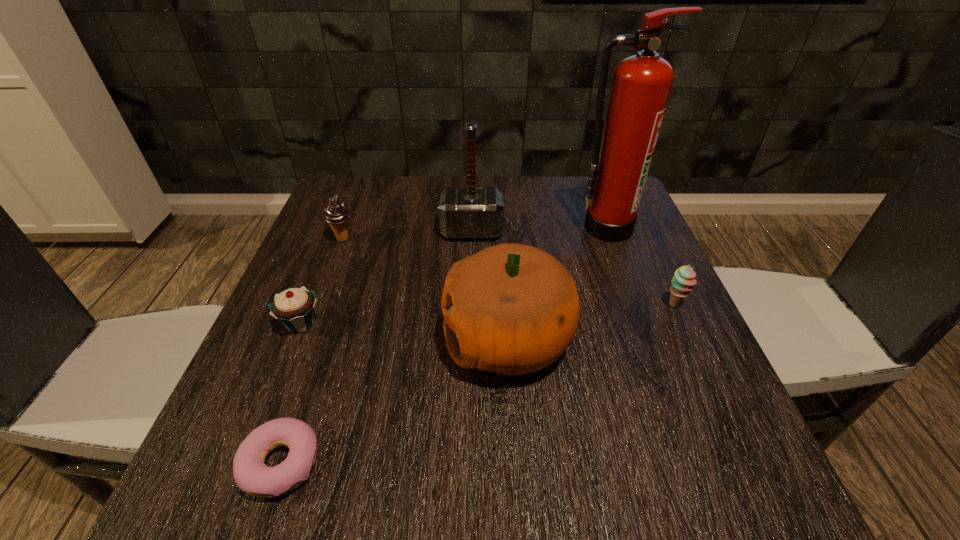
Identify the location of fire extinguisher. The image size is (960, 540). coord(641,85).

Find the location of a particular element. the sixth shortest object is located at coordinates (464, 213).

Image resolution: width=960 pixels, height=540 pixels. Identify the location of the fifth shortest object. (511, 309).

I want to click on icecream, so click(x=336, y=214).

Locate an element on the screen. This screenshot has width=960, height=540. sherbert is located at coordinates (683, 280).

In order to click on the second shortest object in this screenshot , I will do `click(294, 307)`.

You are a GUI agent. You are given a task and a screenshot of the screen. Output one action in this format:
    pyautogui.click(x=<x>, y=<y>)
    Task: Click on the shortest object
    The image size is (960, 540).
    Given the screenshot: What is the action you would take?
    pyautogui.click(x=250, y=473)

The width and height of the screenshot is (960, 540). What are the coordinates of `doughnut` in the screenshot? It's located at (250, 473).

The width and height of the screenshot is (960, 540). Identify the location of vacant space located 0.130m with the nozzle pointing from the back of the fire extinguisher. (626, 281).

Locate an element on the screen. This screenshot has height=540, width=960. vacant space positioned on the back of the hammer is located at coordinates (473, 181).